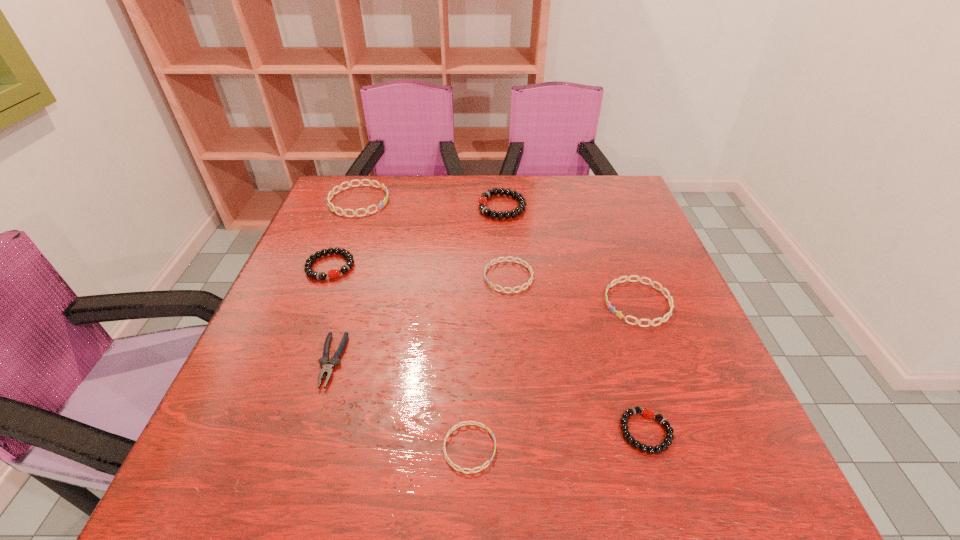
You are a GUI agent. You are given a task and a screenshot of the screen. Output one action in this format:
    pyautogui.click(x=<x>, y=<y>)
    Task: Click on the leftmost blue bracelet
    
    Given the screenshot: What is the action you would take?
    pyautogui.click(x=384, y=188)

Find the location of `the farthest blue bracelet`. the farthest blue bracelet is located at coordinates (384, 188).

At what (x,y) coordinates should I click in order to perform the action: click on the biggest black bracelet. Please return your answer as a coordinate pair (x, y). The width and height of the screenshot is (960, 540). Looking at the image, I should click on (482, 202).

Locate an element on the screen. Image resolution: width=960 pixels, height=540 pixels. the farthest black bracelet is located at coordinates (482, 202).

The image size is (960, 540). What are the coordinates of `the second biggest blue bracelet` in the screenshot? It's located at (619, 314).

Identify the location of the second nearest black bracelet. (334, 273).

Where is `the leftmost black bracelet`? The width and height of the screenshot is (960, 540). the leftmost black bracelet is located at coordinates (334, 273).

I want to click on the second smallest blue bracelet, so click(513, 259).

Image resolution: width=960 pixels, height=540 pixels. Find the location of `pliers`. pliers is located at coordinates (327, 366).

Identify the location of the third nearest object. Image resolution: width=960 pixels, height=540 pixels. (327, 366).